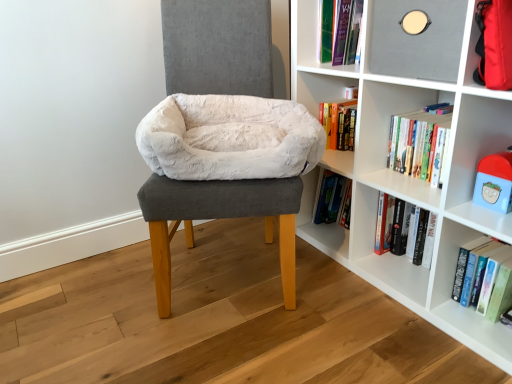
Question: Is white plush toy at upper right at the right side of white matte bookshelf at center?

Choices:
 (A) no
 (B) yes

Answer: (B)

Question: Could you tell me if white plush toy at upper right is turned towards white matte bookshelf at center?

Choices:
 (A) no
 (B) yes

Answer: (B)

Question: Considering the relative sizes of white plush toy at upper right and white matte bookshelf at center in the image provided, is white plush toy at upper right bigger than white matte bookshelf at center?

Choices:
 (A) yes
 (B) no

Answer: (B)

Question: Is white plush toy at upper right not near white matte bookshelf at center?

Choices:
 (A) no
 (B) yes

Answer: (A)

Question: Considering the relative sizes of white plush toy at upper right and white matte bookshelf at center in the image provided, is white plush toy at upper right smaller than white matte bookshelf at center?

Choices:
 (A) no
 (B) yes

Answer: (B)

Question: From a real-world perspective, is white plush pet bed at center physically located above or below hardcover book at lower right?

Choices:
 (A) above
 (B) below

Answer: (A)

Question: Is white plush pet bed at center in front of or behind hardcover book at lower right in the image?

Choices:
 (A) front
 (B) behind

Answer: (A)

Question: Is white plush pet bed at center wider or thinner than hardcover book at lower right?

Choices:
 (A) thin
 (B) wide

Answer: (B)

Question: In terms of height, does white plush pet bed at center look taller or shorter compared to hardcover book at lower right?

Choices:
 (A) tall
 (B) short

Answer: (A)

Question: Is hardcover book at lower right wider or thinner than white fluffy bean bag at center?

Choices:
 (A) thin
 (B) wide

Answer: (A)

Question: Would you say hardcover book at lower right is inside or outside white fluffy bean bag at center?

Choices:
 (A) outside
 (B) inside

Answer: (A)

Question: Does point (462, 292) appear closer or farther from the camera than point (268, 158)?

Choices:
 (A) closer
 (B) farther

Answer: (B)

Question: Would you say hardcover book at lower right is to the left or to the right of white fluffy bean bag at center in the picture?

Choices:
 (A) left
 (B) right

Answer: (B)

Question: Is matte gray shelf at upper right in front of or behind white fluffy bean bag at center in the image?

Choices:
 (A) behind
 (B) front

Answer: (B)

Question: Is matte gray shelf at upper right wider or thinner than white fluffy bean bag at center?

Choices:
 (A) thin
 (B) wide

Answer: (A)